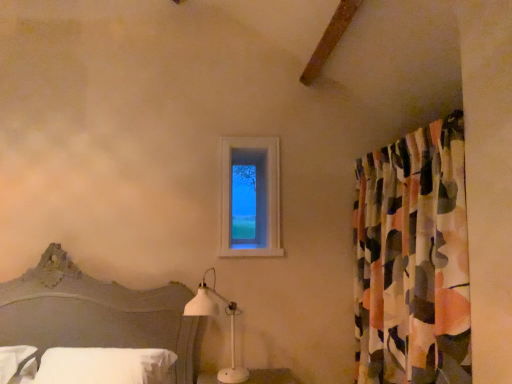
Find the location of a particular element. This screenshot has height=384, width=512. abstract fabric curtain at right is located at coordinates (413, 260).

Image resolution: width=512 pixels, height=384 pixels. I want to click on matte gray headboard at lower left, so click(97, 314).

Locate an element on the screen. table lamp on the right of white soft pillow at lower left is located at coordinates (214, 315).

From a real-world perspective, is white soft pillow at lower left physically located above or below white matte table lamp at lower center?

Clearly, from a real-world perspective, white soft pillow at lower left is below white matte table lamp at lower center.

Is white soft pillow at lower left positioned far away from white matte table lamp at lower center?

No, white soft pillow at lower left is in close proximity to white matte table lamp at lower center.

Which is behind, point (37, 383) or point (215, 280)?

The point (215, 280) is more distant.

Based on their positions, is abstract fabric curtain at right located to the left or right of white matte table lamp at lower center?

From the image, it's evident that abstract fabric curtain at right is to the right of white matte table lamp at lower center.

From a real-world perspective, is abstract fabric curtain at right over white matte table lamp at lower center?

Correct, in the physical world, abstract fabric curtain at right is higher than white matte table lamp at lower center.

How much distance is there between abstract fabric curtain at right and white matte table lamp at lower center?

abstract fabric curtain at right and white matte table lamp at lower center are 1.07 meters apart from each other.

Is point (384, 267) farther from camera compared to point (248, 372)?

No.

Measure the distance between white matte table lamp at lower center and clear glass window at upper center.

33.11 inches.

Between point (234, 379) and point (252, 187), which one is positioned in front?

Point (234, 379)

In the image, there is a clear glass window at upper center. In order to click on table lamp below it (from the image's perspective) in this screenshot , I will do `click(214, 315)`.

Is white matte table lamp at lower center facing away from clear glass window at upper center?

No.

Between abstract fabric curtain at right and clear glass window at upper center, which one appears on the right side from the viewer's perspective?

abstract fabric curtain at right is more to the right.

From the picture: Is abstract fabric curtain at right oriented away from clear glass window at upper center?

That's not correct — abstract fabric curtain at right is not looking away from clear glass window at upper center.

Measure the distance between abstract fabric curtain at right and matte gray headboard at lower left.

abstract fabric curtain at right and matte gray headboard at lower left are 1.37 meters apart.

Does abstract fabric curtain at right appear on the right side of matte gray headboard at lower left?

Yes, abstract fabric curtain at right is to the right of matte gray headboard at lower left.

Is abstract fabric curtain at right not near matte gray headboard at lower left?

That's right, there is a large distance between abstract fabric curtain at right and matte gray headboard at lower left.

Which is closer, (x=445, y=361) or (x=12, y=321)?

Point (x=445, y=361) is closer to the camera than point (x=12, y=321).

Could you tell me if clear glass window at upper center is facing matte gray headboard at lower left?

No, clear glass window at upper center is not turned towards matte gray headboard at lower left.

Is clear glass window at upper center in front of matte gray headboard at lower left?

No, clear glass window at upper center is further to the viewer.

From the image's perspective, is clear glass window at upper center beneath matte gray headboard at lower left?

No, from the image's perspective, clear glass window at upper center is not beneath matte gray headboard at lower left.

Is clear glass window at upper center not close to matte gray headboard at lower left?

clear glass window at upper center is far away from matte gray headboard at lower left.

Locate an element on the screen. This screenshot has width=512, height=384. pillow directly beneath the abstract fabric curtain at right (from a real-world perspective) is located at coordinates (104, 366).

In the scene shown: Are abstract fabric curtain at right and white soft pillow at lower left located far from each other?

Yes.

From a real-world perspective, who is located lower, abstract fabric curtain at right or white soft pillow at lower left?

In real-world perspective, white soft pillow at lower left is lower.

How different are the orientations of abstract fabric curtain at right and white soft pillow at lower left in degrees?

There is a 87.3-degree angle between the facing directions of abstract fabric curtain at right and white soft pillow at lower left.

Image resolution: width=512 pixels, height=384 pixels. In order to click on pillow on the left of white matte table lamp at lower center in this screenshot , I will do `click(104, 366)`.

The height and width of the screenshot is (384, 512). I want to click on table lamp lying behind the abstract fabric curtain at right, so click(x=214, y=315).

From the image, which object appears to be farther from abstract fabric curtain at right, white soft pillow at lower left or clear glass window at upper center?

clear glass window at upper center.

Considering their positions, is white soft pillow at lower left positioned further to white matte table lamp at lower center than matte gray headboard at lower left?

white soft pillow at lower left is further to white matte table lamp at lower center.

When comparing their distances from white soft pillow at lower left, does white matte table lamp at lower center or clear glass window at upper center seem closer?

The object closer to white soft pillow at lower left is white matte table lamp at lower center.

Based on their spatial positions, is matte gray headboard at lower left or white soft pillow at lower left closer to clear glass window at upper center?

matte gray headboard at lower left lies closer to clear glass window at upper center than the other object.

When comparing their distances from abstract fabric curtain at right, does white matte table lamp at lower center or clear glass window at upper center seem further?

clear glass window at upper center lies further to abstract fabric curtain at right than the other object.

Looking at the image, which one is located closer to clear glass window at upper center, abstract fabric curtain at right or white matte table lamp at lower center?

white matte table lamp at lower center lies closer to clear glass window at upper center than the other object.

When comparing their distances from matte gray headboard at lower left, does clear glass window at upper center or abstract fabric curtain at right seem further?

abstract fabric curtain at right.

Estimate the real-world distances between objects in this image. Which object is closer to abstract fabric curtain at right, matte gray headboard at lower left or white soft pillow at lower left?

white soft pillow at lower left lies closer to abstract fabric curtain at right than the other object.

The width and height of the screenshot is (512, 384). Identify the location of pillow located between matte gray headboard at lower left and white matte table lamp at lower center in the depth direction. (104, 366).

Identify the location of window between white soft pillow at lower left and abstract fabric curtain at right in the horizontal direction. The height and width of the screenshot is (384, 512). (250, 197).

Find the location of a particular element. This screenshot has width=512, height=384. pillow located between matte gray headboard at lower left and clear glass window at upper center in the depth direction is located at coordinates coord(104,366).

Where is `table lamp located between matte gray headboard at lower left and clear glass window at upper center in the depth direction`? This screenshot has height=384, width=512. table lamp located between matte gray headboard at lower left and clear glass window at upper center in the depth direction is located at coordinates (214, 315).